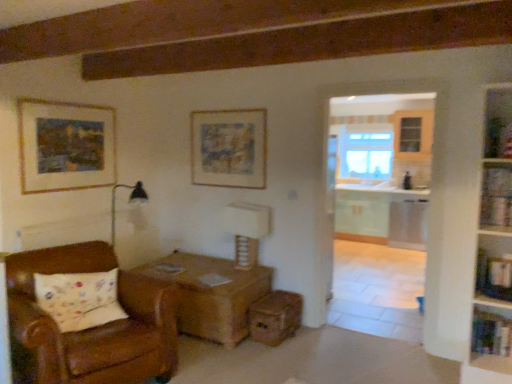
Question: Is the depth of wooden picture frame at upper left, which ranks as the second picture frame in right-to-left order, less than that of white textured table lamp at center?

Choices:
 (A) yes
 (B) no

Answer: (A)

Question: Is wooden picture frame at upper left, which ranks as the second picture frame in right-to-left order, facing towards white textured table lamp at center?

Choices:
 (A) yes
 (B) no

Answer: (B)

Question: Considering the relative sizes of wooden picture frame at upper left, which ranks as the second picture frame in right-to-left order, and white textured table lamp at center in the image provided, is wooden picture frame at upper left, which ranks as the second picture frame in right-to-left order, shorter than white textured table lamp at center?

Choices:
 (A) no
 (B) yes

Answer: (A)

Question: Considering the relative sizes of wooden picture frame at upper left, which ranks as the second picture frame in right-to-left order, and white textured table lamp at center in the image provided, is wooden picture frame at upper left, which ranks as the second picture frame in right-to-left order, wider than white textured table lamp at center?

Choices:
 (A) no
 (B) yes

Answer: (A)

Question: Is wooden picture frame at upper left, the first picture frame positioned from the left, far from white textured table lamp at center?

Choices:
 (A) no
 (B) yes

Answer: (B)

Question: Can you confirm if wooden picture frame at upper left, which ranks as the second picture frame in right-to-left order, is bigger than white textured table lamp at center?

Choices:
 (A) yes
 (B) no

Answer: (B)

Question: Is clear glass window at center positioned in front of wooden shelf at lower right, which is the 1th shelf from bottom to top?

Choices:
 (A) yes
 (B) no

Answer: (B)

Question: Is clear glass window at center bigger than wooden shelf at lower right, which is the 1th shelf from bottom to top?

Choices:
 (A) no
 (B) yes

Answer: (B)

Question: Does clear glass window at center appear on the left side of wooden shelf at lower right, the 3th shelf when ordered from top to bottom?

Choices:
 (A) yes
 (B) no

Answer: (B)

Question: Is clear glass window at center with wooden shelf at lower right, which is the 1th shelf from bottom to top?

Choices:
 (A) no
 (B) yes

Answer: (A)

Question: Can you confirm if clear glass window at center is taller than wooden shelf at lower right, which is the 1th shelf from bottom to top?

Choices:
 (A) no
 (B) yes

Answer: (B)

Question: Is clear glass window at center to the right of wooden shelf at lower right, which is the 1th shelf from bottom to top, from the viewer's perspective?

Choices:
 (A) yes
 (B) no

Answer: (A)